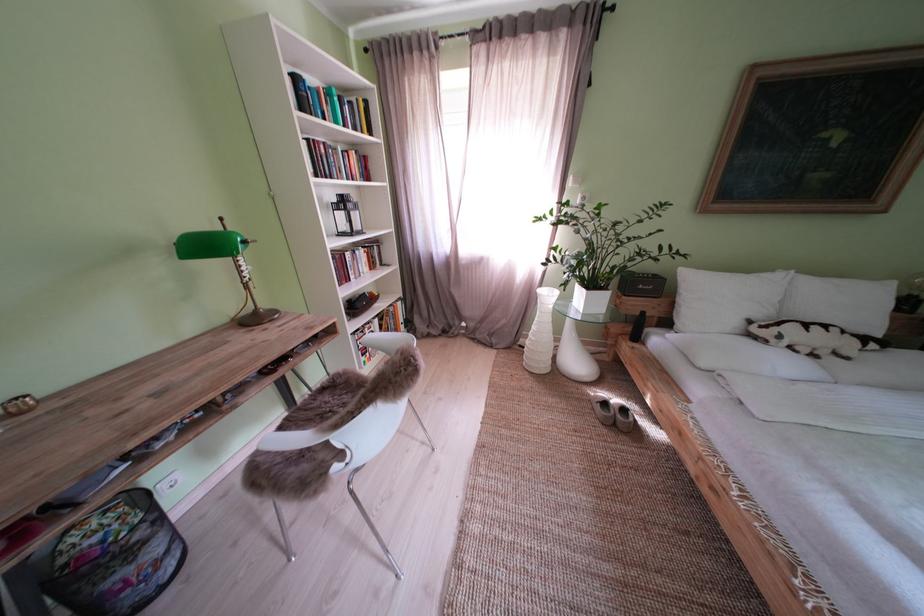
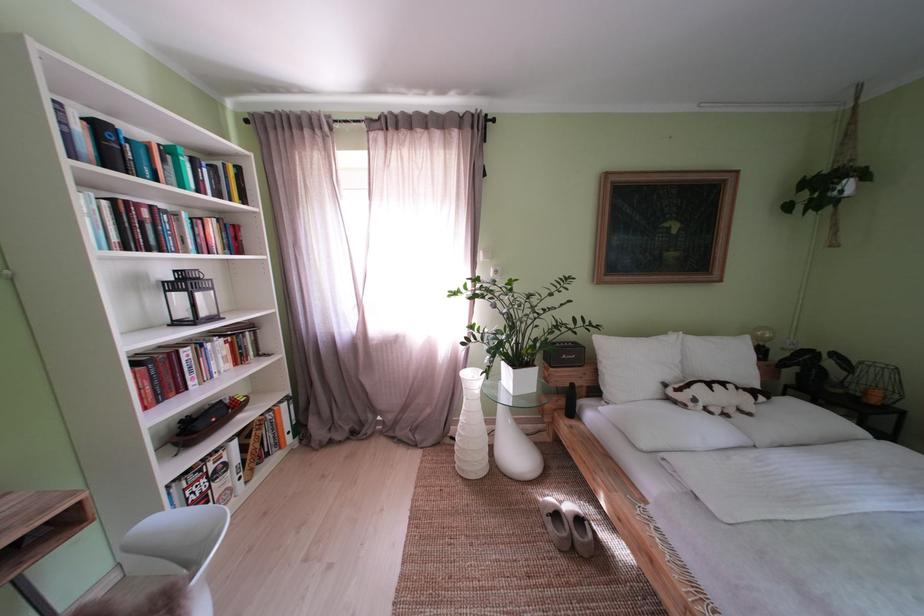
Locate, in the second image, the point that corresponds to (792,342) in the first image.

(706, 406)